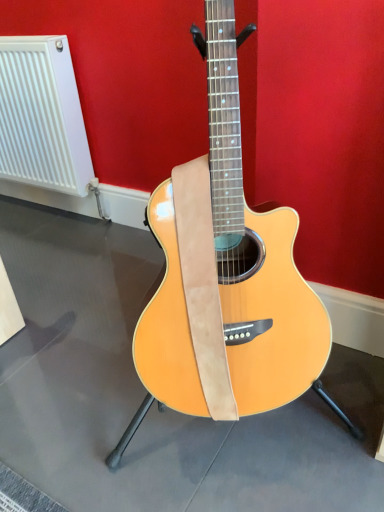
Where is `white plastic radiator at upper left`? This screenshot has width=384, height=512. white plastic radiator at upper left is located at coordinates (42, 116).

Image resolution: width=384 pixels, height=512 pixels. What do you see at coordinates (42, 116) in the screenshot?
I see `white plastic radiator at upper left` at bounding box center [42, 116].

Find the location of a particular element. This screenshot has height=512, width=384. white plastic radiator at upper left is located at coordinates (42, 116).